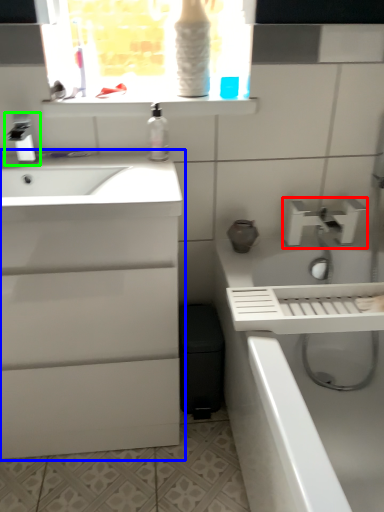
Question: Estimate the real-world distances between objects in this image. Which object is farther from tap (highlighted by a red box), bathroom cabinet (highlighted by a blue box) or tap (highlighted by a green box)?

Choices:
 (A) bathroom cabinet
 (B) tap

Answer: (B)